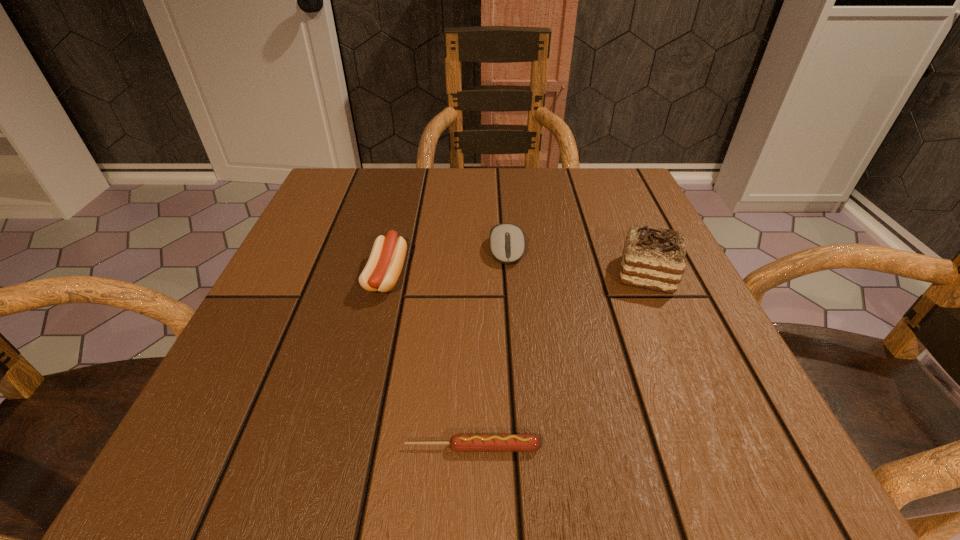
Locate an element on the screen. free space that is in between the shorter sausage and the rightmost object is located at coordinates (560, 361).

This screenshot has width=960, height=540. I want to click on vacant region between the chocolate cake and the left sausage, so click(516, 274).

Identify the location of empty location between the nearest object and the second shortest object. This screenshot has height=540, width=960. (490, 348).

At what (x,y) coordinates should I click in order to perform the action: click on empty space that is in between the taller sausage and the third tallest object. Please return your answer as a coordinate pair (x, y). Looking at the image, I should click on (446, 262).

Locate an element on the screen. free space that is in between the leftmost object and the right sausage is located at coordinates (429, 361).

You are a GUI agent. You are given a task and a screenshot of the screen. Output one action in this format:
    pyautogui.click(x=<x>, y=<y>)
    Task: Click on the free space between the nearest object and the computer equipment
    This screenshot has height=540, width=960.
    Given the screenshot: What is the action you would take?
    pyautogui.click(x=490, y=348)

Locate an element on the screen. empty location between the second shortest object and the rightmost object is located at coordinates (577, 262).

The width and height of the screenshot is (960, 540). Identify the location of vacant space in between the shorter sausage and the chocolate cake. (560, 361).

The width and height of the screenshot is (960, 540). Find the location of `vacant area between the taller sausage and the right sausage`. vacant area between the taller sausage and the right sausage is located at coordinates (429, 361).

Locate which object ranks in proximity to the shorter sausage. Please provide its 2D coordinates. Your answer should be formatted as a tuple, i.e. [(x, y)], where the tuple contains the x and y coordinates of a point satisfying the conditions above.

[(383, 268)]